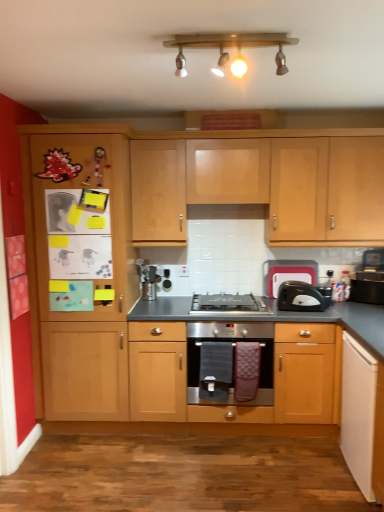
Question: From a real-world perspective, is black plastic toaster at right, marked as the 2th appliance in a right-to-left arrangement, under satin silver oven at center?

Choices:
 (A) no
 (B) yes

Answer: (A)

Question: Is black plastic toaster at right, marked as the 2th appliance in a right-to-left arrangement, to the left of satin silver oven at center from the viewer's perspective?

Choices:
 (A) yes
 (B) no

Answer: (B)

Question: From the image's perspective, is black plastic toaster at right, marked as the 2th appliance in a right-to-left arrangement, located above satin silver oven at center?

Choices:
 (A) yes
 (B) no

Answer: (A)

Question: Does black plastic toaster at right, the second appliance viewed from the front, have a lesser width compared to satin silver oven at center?

Choices:
 (A) no
 (B) yes

Answer: (B)

Question: Is black plastic toaster at right, marked as the 2th appliance in a right-to-left arrangement, aimed at satin silver oven at center?

Choices:
 (A) yes
 (B) no

Answer: (B)

Question: From a real-world perspective, is wooden cabinet at center, marked as the 2th cabinetry in a bottom-to-top arrangement, physically located above or below white matte cabinet at lower right, the 1th cabinetry when ordered from bottom to top?

Choices:
 (A) above
 (B) below

Answer: (A)

Question: In terms of size, does wooden cabinet at center, marked as the 2th cabinetry in a bottom-to-top arrangement, appear bigger or smaller than white matte cabinet at lower right, the 1th cabinetry when ordered from bottom to top?

Choices:
 (A) big
 (B) small

Answer: (A)

Question: Which is correct: wooden cabinet at center, marked as the 2th cabinetry in a bottom-to-top arrangement, is inside white matte cabinet at lower right, the 1th cabinetry when ordered from bottom to top, or outside of it?

Choices:
 (A) outside
 (B) inside

Answer: (A)

Question: Is wooden cabinet at center, marked as the 2th cabinetry in a bottom-to-top arrangement, wider or thinner than white matte cabinet at lower right, which appears as the third cabinetry when viewed from the top?

Choices:
 (A) wide
 (B) thin

Answer: (A)

Question: From a real-world perspective, relative to black plastic toaster at right, the second appliance when ordered from back to front, is black plastic toaster at right, marked as the first appliance in a left-to-right arrangement, vertically above or below?

Choices:
 (A) below
 (B) above

Answer: (B)

Question: Is point (274, 291) closer or farther from the camera than point (357, 289)?

Choices:
 (A) closer
 (B) farther

Answer: (A)

Question: Considering the positions of black plastic toaster at right, the 1th appliance when ordered from back to front, and black plastic toaster at right, placed as the second appliance when sorted from left to right, in the image, is black plastic toaster at right, the 1th appliance when ordered from back to front, taller or shorter than black plastic toaster at right, placed as the second appliance when sorted from left to right,?

Choices:
 (A) short
 (B) tall

Answer: (B)

Question: In the image, is black plastic toaster at right, the second appliance viewed from the front, on the left side or the right side of black plastic toaster at right, placed as the second appliance when sorted from left to right?

Choices:
 (A) left
 (B) right

Answer: (A)

Question: In the image, is light wood cabinet at upper center, marked as the third cabinetry in a bottom-to-top arrangement, on the left side or the right side of wooden ceiling lights at upper center?

Choices:
 (A) left
 (B) right

Answer: (B)

Question: Based on their sizes in the image, would you say light wood cabinet at upper center, acting as the first cabinetry starting from the top, is bigger or smaller than wooden ceiling lights at upper center?

Choices:
 (A) big
 (B) small

Answer: (A)